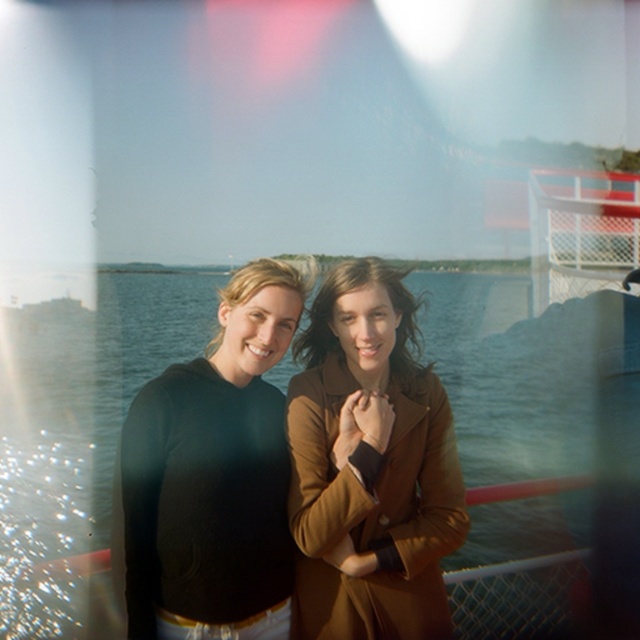
Looking at this image, you are a photographer trying to capture both the brown leather jacket at center and the matte brown coat at center in a single frame. Since the camera can only focus on one subject at a time, which subject should you focus on first to ensure the other remains in the background?

The brown leather jacket at center is located below matte brown coat at center. Focus on the matte brown coat at center first since it is higher up, allowing the lower brown leather jacket at center to naturally fall into the background of the photo.

You are a photographer trying to capture a photo of the two people wearing the black matte sweater at center and the matte brown coat at center. Based on their positions, which one would appear closer to the bottom of the photo?

The black matte sweater at center appears closer to the bottom of the photo because it is located below the matte brown coat at center.

You are a photographer standing on a boat, and you want to take a photo of both the brown leather jacket at center and the matte brown coat at center. The minimum distance required between subjects for your camera to focus properly is 3 feet. Will the camera focus correctly on both subjects?

The distance between the brown leather jacket at center and matte brown coat at center is 3.40 feet, which is greater than the minimum required 3 feet. Therefore, the camera will focus correctly on both subjects.